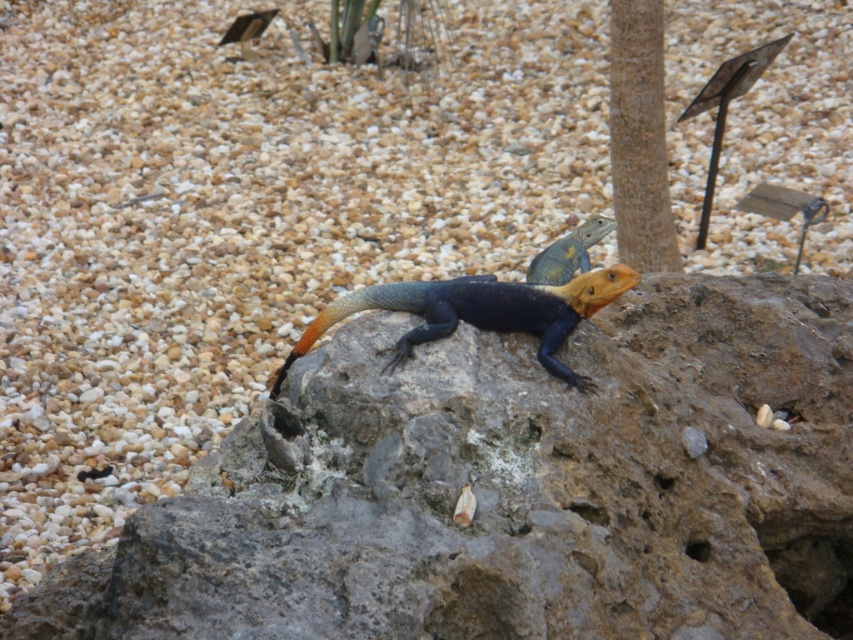
You are a photographer aiming to capture both the shiny blue lizard at center and the smooth brown pole at upper center in a single frame. Based on their positions, which object should you focus on first to ensure both are in focus?

The shiny blue lizard at center has a lesser height compared to smooth brown pole at upper center, so you should focus on the smooth brown pole at upper center first since it is farther away and adjusting focus from far to near can help ensure both are in focus.

Looking at this image, you are a hiker who wants to place a small rock on the ground near the rough stone boulder at center and the shiny blue lizard at center. Which object should you place it closer to if you want it to be under the lizard?

You should place the small rock closer to the shiny blue lizard at center because the rough stone boulder at center is positioned under it, so placing the rock near the lizard would mean it is under the lizard.